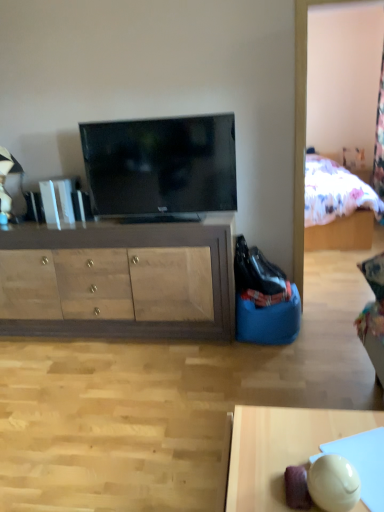
Question: From the image's perspective, is wooden cabinet at center above or below smooth wooden desk at lower right?

Choices:
 (A) above
 (B) below

Answer: (A)

Question: In terms of height, does wooden cabinet at center look taller or shorter compared to smooth wooden desk at lower right?

Choices:
 (A) tall
 (B) short

Answer: (A)

Question: Based on their relative distances, which object is farther from the wooden cabinet at center?

Choices:
 (A) smooth wooden desk at lower right
 (B) matte black tv at center

Answer: (A)

Question: Which is nearer to the matte black tv at center?

Choices:
 (A) smooth wooden desk at lower right
 (B) wooden cabinet at center

Answer: (B)